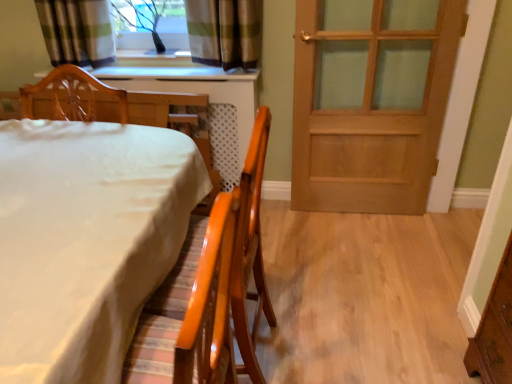
Question: Is point (395, 120) closer or farther from the camera than point (151, 266)?

Choices:
 (A) closer
 (B) farther

Answer: (B)

Question: In the image, is wooden door at right positioned in front of or behind white glossy table at lower left?

Choices:
 (A) front
 (B) behind

Answer: (B)

Question: Which object is the closest to the wooden chair at left, which appears as the first chair when viewed from the left?

Choices:
 (A) matte orange chair at lower left, positioned as the 1th chair in right-to-left order
 (B) white glossy table at lower left
 (C) clear glass window at upper center
 (D) wooden door at right

Answer: (C)

Question: Which of these objects is positioned closest to the wooden door at right?

Choices:
 (A) matte orange chair at lower left, positioned as the 1th chair in right-to-left order
 (B) clear glass window at upper center
 (C) white glossy table at lower left
 (D) wooden chair at left, which ranks as the 2th chair in right-to-left order

Answer: (D)